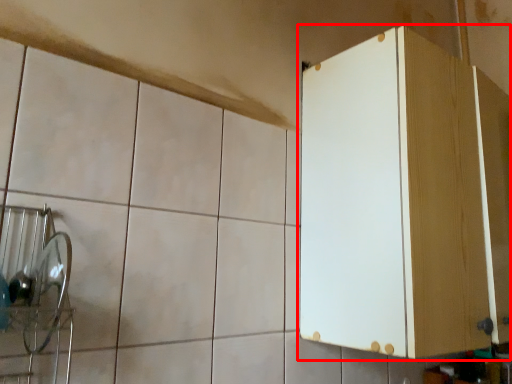
Question: From the image's perspective, where is cabinetry (annotated by the red box) located in relation to ceramic tile in the image?

Choices:
 (A) below
 (B) above

Answer: (B)